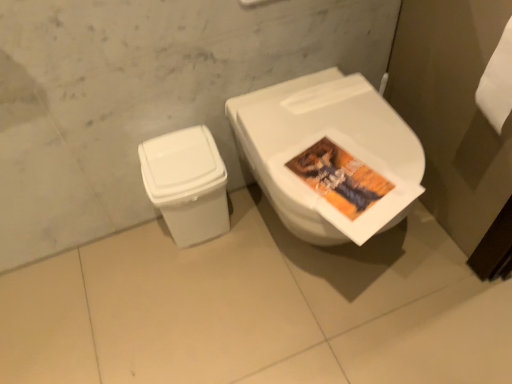
I want to click on vacant region to the left of white glossy toilet at center, so [188, 288].